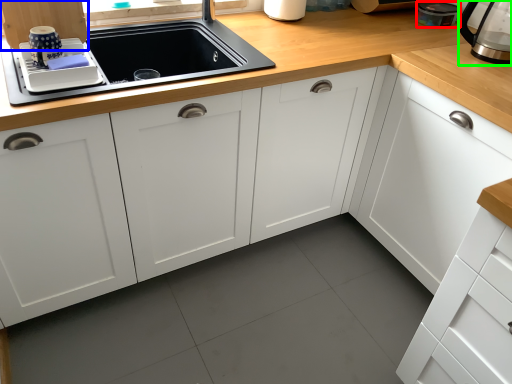
Question: Considering the real-world distances, which object is farthest from appliance (highlighted by a red box)? cabinetry (highlighted by a blue box) or coffeepot (highlighted by a green box)?

Choices:
 (A) cabinetry
 (B) coffeepot

Answer: (A)